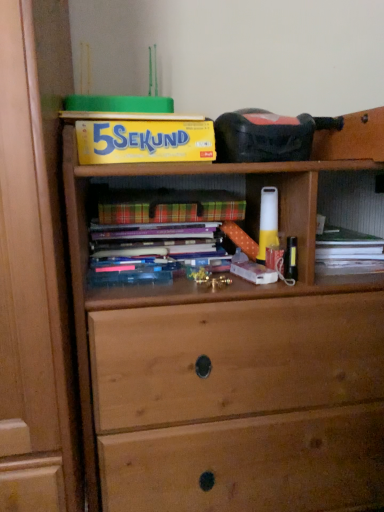
Question: Can you confirm if yellow cardboard box at upper center, acting as the 2th paperback book starting from the bottom, is positioned to the left of plaid paper at center, arranged as the second paperback book when viewed from the top?

Choices:
 (A) yes
 (B) no

Answer: (A)

Question: Does yellow cardboard box at upper center, which appears as the 1th paperback book when viewed from the top, have a lesser height compared to plaid paper at center, arranged as the second paperback book when viewed from the top?

Choices:
 (A) yes
 (B) no

Answer: (B)

Question: Is yellow cardboard box at upper center, acting as the 2th paperback book starting from the bottom, far from plaid paper at center, arranged as the 1th paperback book when ordered from the bottom?

Choices:
 (A) yes
 (B) no

Answer: (B)

Question: Is yellow cardboard box at upper center, acting as the 2th paperback book starting from the bottom, not within plaid paper at center, arranged as the second paperback book when viewed from the top?

Choices:
 (A) no
 (B) yes

Answer: (B)

Question: From the image's perspective, does yellow cardboard box at upper center, which appears as the 1th paperback book when viewed from the top, appear lower than plaid paper at center, arranged as the second paperback book when viewed from the top?

Choices:
 (A) no
 (B) yes

Answer: (A)

Question: Is yellow cardboard box at upper center, acting as the 2th paperback book starting from the bottom, inside or outside of hardcover book at center?

Choices:
 (A) outside
 (B) inside

Answer: (A)

Question: From the image's perspective, relative to hardcover book at center, is yellow cardboard box at upper center, which appears as the 1th paperback book when viewed from the top, above or below?

Choices:
 (A) below
 (B) above

Answer: (B)

Question: Is yellow cardboard box at upper center, acting as the 2th paperback book starting from the bottom, in front of or behind hardcover book at center in the image?

Choices:
 (A) behind
 (B) front

Answer: (B)

Question: Is point (198, 122) closer or farther from the camera than point (152, 234)?

Choices:
 (A) closer
 (B) farther

Answer: (A)

Question: From the image's perspective, is plaid paper at center, arranged as the second paperback book when viewed from the top, located above or below hardcover book at center?

Choices:
 (A) above
 (B) below

Answer: (A)

Question: Is plaid paper at center, arranged as the 1th paperback book when ordered from the bottom, wider or thinner than hardcover book at center?

Choices:
 (A) thin
 (B) wide

Answer: (B)

Question: Is point (198, 219) positioned closer to the camera than point (135, 233)?

Choices:
 (A) closer
 (B) farther

Answer: (A)

Question: Relative to hardcover book at center, is plaid paper at center, arranged as the 1th paperback book when ordered from the bottom, in front or behind?

Choices:
 (A) front
 (B) behind

Answer: (A)

Question: From a real-world perspective, relative to yellow cardboard box at upper center, acting as the 2th paperback book starting from the bottom, is plaid paper at center, arranged as the second paperback book when viewed from the top, vertically above or below?

Choices:
 (A) above
 (B) below

Answer: (B)

Question: Is plaid paper at center, arranged as the second paperback book when viewed from the top, taller or shorter than yellow cardboard box at upper center, acting as the 2th paperback book starting from the bottom?

Choices:
 (A) tall
 (B) short

Answer: (B)